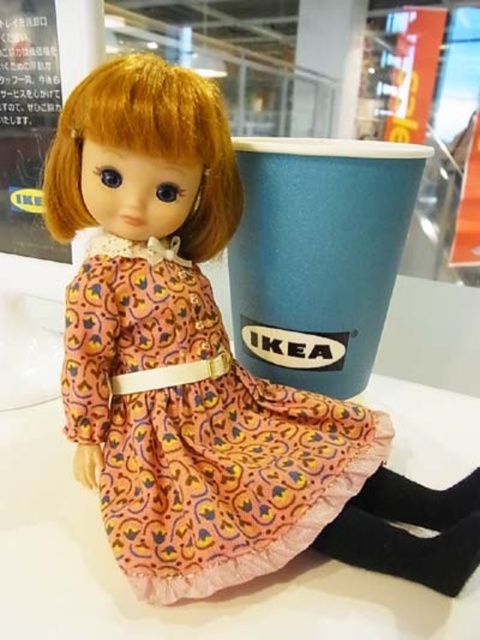
Is the position of printed fabric dress at center less distant than that of blue paper cup at upper center?

Yes, it is in front of blue paper cup at upper center.

Does point (175, 552) come closer to viewer compared to point (303, 144)?

Yes, it is in front of point (303, 144).

I want to click on printed fabric dress at center, so click(x=196, y=429).

Where is `printed fabric dress at center`? printed fabric dress at center is located at coordinates (x=196, y=429).